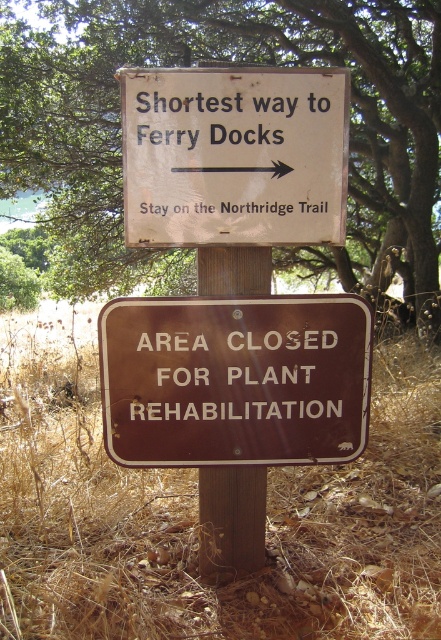
Image resolution: width=441 pixels, height=640 pixels. Identify the location of white paper sign at center. (234, 156).

Is white paper sign at center shorter than brown wood post at center?

In fact, white paper sign at center may be taller than brown wood post at center.

Where is `white paper sign at center`? white paper sign at center is located at coordinates (234, 156).

Between brown wooden sign at center and brown wood post at center, which one is positioned lower?

brown wood post at center is lower down.

Does point (306, 452) lie in front of point (201, 570)?

Yes, it is in front of point (201, 570).

Find the location of a particular element. brown wooden sign at center is located at coordinates (235, 380).

Looking at this image, is green leafy tree at upper center closer to the viewer compared to white paper sign at center?

No, green leafy tree at upper center is further to the viewer.

Find the location of a particular element. The width and height of the screenshot is (441, 640). green leafy tree at upper center is located at coordinates (243, 61).

This screenshot has height=640, width=441. What do you see at coordinates (243, 61) in the screenshot?
I see `green leafy tree at upper center` at bounding box center [243, 61].

The width and height of the screenshot is (441, 640). In order to click on green leafy tree at upper center in this screenshot , I will do `click(243, 61)`.